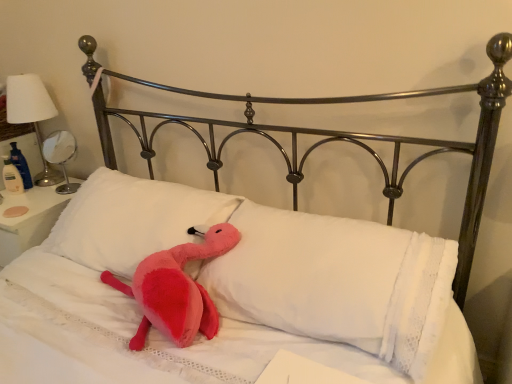
Question: From the image's perspective, is white soft pillow at center, the first pillow viewed from the left, above or below metallic silver table lamp at left, which is the first table lamp from left to right?

Choices:
 (A) above
 (B) below

Answer: (B)

Question: From their relative heights in the image, would you say white soft pillow at center, the first pillow viewed from the left, is taller or shorter than metallic silver table lamp at left, which is the first table lamp from left to right?

Choices:
 (A) tall
 (B) short

Answer: (B)

Question: Estimate the real-world distances between objects in this image. Which object is farther from the white glossy table lamp at left, the first table lamp positioned from the right?

Choices:
 (A) white soft pillow at center, which is the second pillow in left-to-right order
 (B) metallic silver table lamp at left, which is the first table lamp from left to right
 (C) white soft pillow at center, the first pillow viewed from the left

Answer: (A)

Question: Which object is the closest to the white soft pillow at center, which is the 2th pillow in right-to-left order?

Choices:
 (A) metallic silver table lamp at left, the 2th table lamp in the right-to-left sequence
 (B) white soft pillow at center, which is the second pillow in left-to-right order
 (C) white glossy table lamp at left, the first table lamp positioned from the right

Answer: (B)